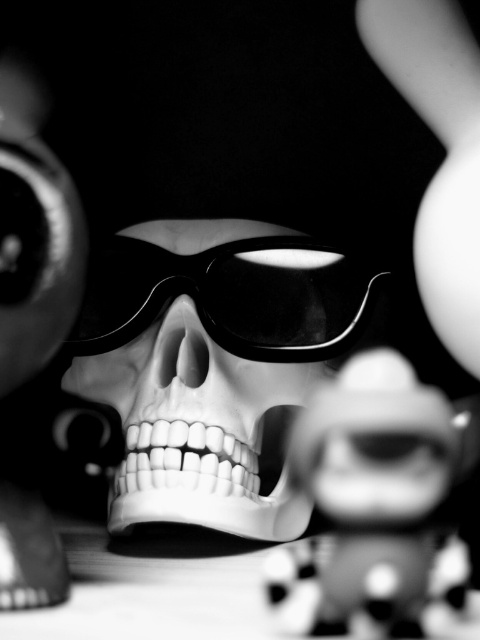
Does polka dot fabric skull at center appear over black glossy goggles at center?

No.

Does point (450, 634) come behind point (156, 260)?

No, it is not.

This screenshot has width=480, height=640. In order to click on polka dot fabric skull at center in this screenshot , I will do coord(379,508).

This screenshot has height=640, width=480. What are the coordinates of `polka dot fabric skull at center` in the screenshot? It's located at (379, 508).

In the scene shown: Who is shorter, polka dot fabric skull at center or smooth plastic skull at center?

With less height is polka dot fabric skull at center.

Describe the element at coordinates (379, 508) in the screenshot. Image resolution: width=480 pixels, height=640 pixels. I see `polka dot fabric skull at center` at that location.

Based on the photo, who is more distant from viewer, (283, 618) or (235, 224)?

The point (235, 224) is more distant.

The width and height of the screenshot is (480, 640). I want to click on polka dot fabric skull at center, so click(379, 508).

Does smooth plastic skull at center have a smaller size compared to black glossy goggles at center?

No.

You are a GUI agent. You are given a task and a screenshot of the screen. Output one action in this format:
    pyautogui.click(x=<x>, y=<y>)
    Task: Click on the smooth plastic skull at center
    Image resolution: width=480 pixels, height=640 pixels.
    Given the screenshot: What is the action you would take?
    (194, 428)